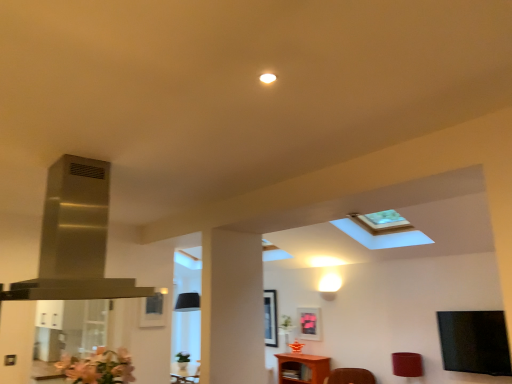
Question: Does transparent glass door at left appear on the right side of brown wooden table at lower center?

Choices:
 (A) yes
 (B) no

Answer: (B)

Question: Could you tell me if transparent glass door at left is facing brown wooden table at lower center?

Choices:
 (A) no
 (B) yes

Answer: (A)

Question: From a real-world perspective, is transparent glass door at left positioned over brown wooden table at lower center based on gravity?

Choices:
 (A) no
 (B) yes

Answer: (B)

Question: Can you confirm if transparent glass door at left is thinner than brown wooden table at lower center?

Choices:
 (A) yes
 (B) no

Answer: (B)

Question: Is transparent glass door at left outside brown wooden table at lower center?

Choices:
 (A) yes
 (B) no

Answer: (A)

Question: Is the position of transparent glass door at left more distant than that of brown wooden table at lower center?

Choices:
 (A) yes
 (B) no

Answer: (B)

Question: Would you say matte black picture frame at center, placed as the first picture frame when sorted from front to back, is part of stainless steel exhaust hood at upper left's contents?

Choices:
 (A) no
 (B) yes

Answer: (A)

Question: Considering the relative sizes of stainless steel exhaust hood at upper left and matte black picture frame at center, which is the third picture frame from right to left, in the image provided, is stainless steel exhaust hood at upper left bigger than matte black picture frame at center, which is the third picture frame from right to left,?

Choices:
 (A) yes
 (B) no

Answer: (A)

Question: From the image's perspective, is stainless steel exhaust hood at upper left on top of matte black picture frame at center, which is the third picture frame from right to left?

Choices:
 (A) no
 (B) yes

Answer: (B)

Question: Can you confirm if stainless steel exhaust hood at upper left is shorter than matte black picture frame at center, which is the third picture frame from right to left?

Choices:
 (A) no
 (B) yes

Answer: (A)

Question: Can you confirm if stainless steel exhaust hood at upper left is wider than matte black picture frame at center, which is counted as the 3th picture frame, starting from the back?

Choices:
 (A) yes
 (B) no

Answer: (A)

Question: Considering the relative positions of stainless steel exhaust hood at upper left and matte black picture frame at center, which is the third picture frame from right to left, in the image provided, is stainless steel exhaust hood at upper left in front of matte black picture frame at center, which is the third picture frame from right to left,?

Choices:
 (A) yes
 (B) no

Answer: (A)

Question: From the image's perspective, is matte red lampshade at lower right on brown wooden table at lower center?

Choices:
 (A) yes
 (B) no

Answer: (A)